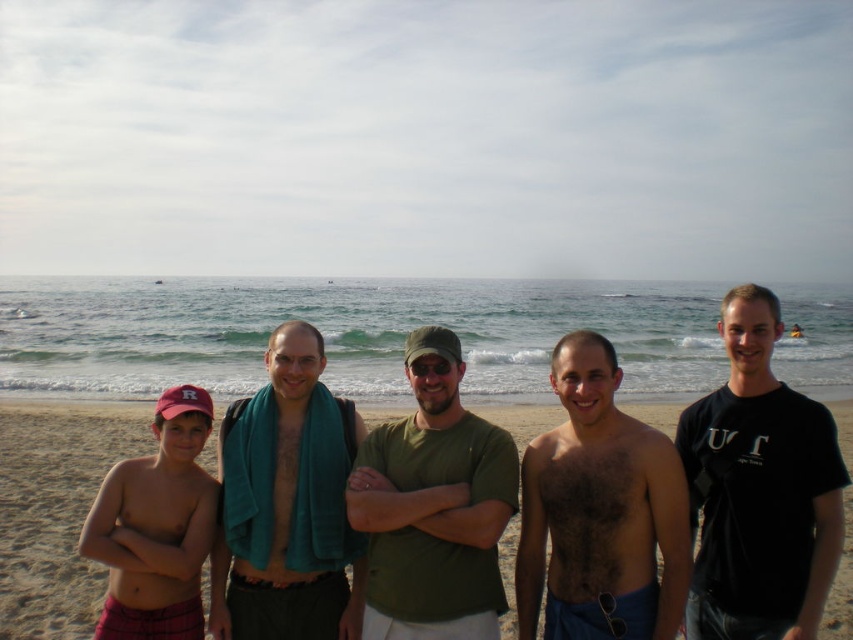
Question: Which point is farther from the camera taking this photo?

Choices:
 (A) (697, 483)
 (B) (601, 596)
 (C) (347, 593)
 (D) (421, 492)

Answer: (C)

Question: Does hairy skin at center come behind brown sand at center?

Choices:
 (A) no
 (B) yes

Answer: (A)

Question: Does black matte t-shirt at right have a smaller size compared to hairy skin at center?

Choices:
 (A) yes
 (B) no

Answer: (B)

Question: Among these points, which one is nearest to the camera?

Choices:
 (A) (141, 518)
 (B) (430, 480)
 (C) (660, 408)
 (D) (573, 481)

Answer: (D)

Question: Which point is farther from the camera taking this photo?

Choices:
 (A) (793, 397)
 (B) (175, 480)

Answer: (B)

Question: Is black matte t-shirt at right closer to the viewer compared to red cotton cap at left?

Choices:
 (A) no
 (B) yes

Answer: (B)